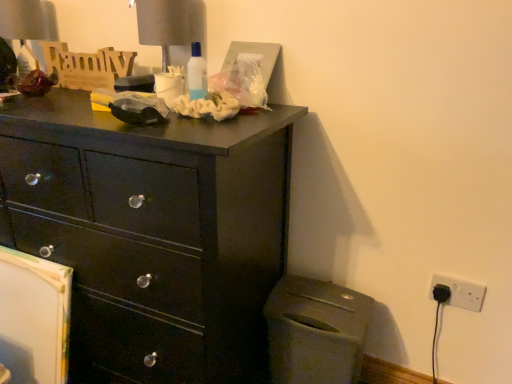
The image size is (512, 384). In order to click on matte gray table lamp at upper center, marked as the first table lamp in a right-to-left arrangement in this screenshot , I will do `click(170, 24)`.

This screenshot has width=512, height=384. Describe the element at coordinates (316, 331) in the screenshot. I see `matte gray trash can at lower right` at that location.

Image resolution: width=512 pixels, height=384 pixels. I want to click on white plastic electric outlet at lower right, so click(x=460, y=292).

Considering the positions of objects white plastic electric outlet at lower right and matte gray table lamp at upper left, the second table lamp positioned from the right, in the image provided, who is more to the left, white plastic electric outlet at lower right or matte gray table lamp at upper left, the second table lamp positioned from the right,?

Positioned to the left is matte gray table lamp at upper left, the second table lamp positioned from the right.

From the image's perspective, is white plastic electric outlet at lower right positioned above or below matte gray table lamp at upper left, the second table lamp positioned from the right?

From the image's perspective, white plastic electric outlet at lower right appears below matte gray table lamp at upper left, the second table lamp positioned from the right.

Is white plastic electric outlet at lower right not within matte gray table lamp at upper left, the second table lamp positioned from the right?

Indeed, white plastic electric outlet at lower right is completely outside matte gray table lamp at upper left, the second table lamp positioned from the right.

Is matte black dresser at upper left completely or partially outside of white plastic electric outlet at lower right?

Yes, matte black dresser at upper left is outside of white plastic electric outlet at lower right.

Where is `electric outlet below the matte black dresser at upper left (from a real-world perspective)`? electric outlet below the matte black dresser at upper left (from a real-world perspective) is located at coordinates (460, 292).

In the scene shown: From a real-world perspective, is matte black dresser at upper left located higher than white plastic electric outlet at lower right?

Yes, from a real-world perspective, matte black dresser at upper left is above white plastic electric outlet at lower right.

How different are the orientations of matte black dresser at upper left and white plastic electric outlet at lower right in degrees?

There is a 0.537-degree angle between the facing directions of matte black dresser at upper left and white plastic electric outlet at lower right.

Is matte gray table lamp at upper left, which appears as the 1th table lamp when viewed from the back, not close to matte black dresser at upper left?

They are positioned close to each other.

Is matte gray table lamp at upper left, which appears as the 1th table lamp when viewed from the back, facing away from matte black dresser at upper left?

No, matte black dresser at upper left is not at the back of matte gray table lamp at upper left, which appears as the 1th table lamp when viewed from the back.

Is matte gray table lamp at upper left, placed as the 1th table lamp when sorted from left to right, situated inside matte black dresser at upper left or outside?

matte gray table lamp at upper left, placed as the 1th table lamp when sorted from left to right, is outside matte black dresser at upper left.

From a real-world perspective, is matte gray table lamp at upper left, which appears as the 1th table lamp when viewed from the back, positioned above or below matte black dresser at upper left?

In terms of real-world spatial position, matte gray table lamp at upper left, which appears as the 1th table lamp when viewed from the back, is above matte black dresser at upper left.

Does matte gray trash can at lower right turn towards matte gray table lamp at upper center, the 2th table lamp when ordered from back to front?

No.

From the image's perspective, which is below, matte gray trash can at lower right or matte gray table lamp at upper center, which is the second table lamp in left-to-right order?

matte gray trash can at lower right is shown below in the image.

From the matte gray trash can at lower right, count 1st table lamps backward and point to it. Please provide its 2D coordinates.

[(170, 24)]

Considering the relative sizes of matte gray trash can at lower right and matte gray table lamp at upper center, which is the second table lamp in left-to-right order, in the image provided, is matte gray trash can at lower right taller than matte gray table lamp at upper center, which is the second table lamp in left-to-right order,?

Yes, matte gray trash can at lower right is taller than matte gray table lamp at upper center, which is the second table lamp in left-to-right order.

Which object is closer to the camera, matte gray table lamp at upper center, which is the second table lamp in left-to-right order, or matte gray trash can at lower right?

matte gray trash can at lower right is closer to the camera.

Is matte gray table lamp at upper center, which ranks as the first table lamp in front-to-back order, bigger than matte gray trash can at lower right?

Incorrect, matte gray table lamp at upper center, which ranks as the first table lamp in front-to-back order, is not larger than matte gray trash can at lower right.

Considering the relative sizes of matte gray table lamp at upper center, which ranks as the first table lamp in front-to-back order, and matte gray trash can at lower right in the image provided, is matte gray table lamp at upper center, which ranks as the first table lamp in front-to-back order, thinner than matte gray trash can at lower right?

Indeed, matte gray table lamp at upper center, which ranks as the first table lamp in front-to-back order, has a lesser width compared to matte gray trash can at lower right.

From the image's perspective, which one is positioned lower, matte gray table lamp at upper center, which ranks as the first table lamp in front-to-back order, or matte gray trash can at lower right?

matte gray trash can at lower right is shown below in the image.

From a real-world perspective, relative to matte black dresser at upper left, is matte gray trash can at lower right vertically above or below?

From a real-world perspective, matte gray trash can at lower right is physically below matte black dresser at upper left.

Where is `cabinetry to the right of matte black dresser at upper left`? The width and height of the screenshot is (512, 384). cabinetry to the right of matte black dresser at upper left is located at coordinates (316, 331).

Does matte gray trash can at lower right have a greater width compared to matte black dresser at upper left?

In fact, matte gray trash can at lower right might be narrower than matte black dresser at upper left.

Considering the relative positions of matte gray trash can at lower right and matte black dresser at upper left in the image provided, is matte gray trash can at lower right to the left or to the right of matte black dresser at upper left?

Clearly, matte gray trash can at lower right is on the right of matte black dresser at upper left in the image.

Can you confirm if white plastic electric outlet at lower right is smaller than matte gray table lamp at upper center, the 2th table lamp when ordered from back to front?

Indeed, white plastic electric outlet at lower right has a smaller size compared to matte gray table lamp at upper center, the 2th table lamp when ordered from back to front.

The image size is (512, 384). Identify the location of electric outlet behind the matte gray table lamp at upper center, which ranks as the first table lamp in front-to-back order. coord(460,292).

Is white plastic electric outlet at lower right facing towards matte gray table lamp at upper center, marked as the first table lamp in a right-to-left arrangement?

No, white plastic electric outlet at lower right does not turn towards matte gray table lamp at upper center, marked as the first table lamp in a right-to-left arrangement.

From a real-world perspective, is white plastic electric outlet at lower right located beneath matte gray table lamp at upper center, which ranks as the first table lamp in front-to-back order?

Yes, from a real-world perspective, white plastic electric outlet at lower right is beneath matte gray table lamp at upper center, which ranks as the first table lamp in front-to-back order.

You are a GUI agent. You are given a task and a screenshot of the screen. Output one action in this format:
    pyautogui.click(x=<x>, y=<y>)
    Task: Click on the electric outlet below the matte gray table lamp at upper left, the second table lamp positioned from the right (from a real-world perspective)
    
    Given the screenshot: What is the action you would take?
    pyautogui.click(x=460, y=292)

Locate an element on the screen. The image size is (512, 384). the chest of drawers that appears above the white plastic electric outlet at lower right (from a real-world perspective) is located at coordinates coord(153,233).

In the scene shown: Considering their positions, is matte black dresser at upper left positioned further to matte gray table lamp at upper left, placed as the 1th table lamp when sorted from left to right, than white plastic electric outlet at lower right?

The object further to matte gray table lamp at upper left, placed as the 1th table lamp when sorted from left to right, is white plastic electric outlet at lower right.

When comparing their distances from matte gray table lamp at upper left, placed as the 1th table lamp when sorted from left to right, does white plastic electric outlet at lower right or matte gray table lamp at upper center, which ranks as the first table lamp in front-to-back order, seem further?

white plastic electric outlet at lower right.

Which object lies further to the anchor point matte gray table lamp at upper left, the second table lamp positioned from the right, white plastic electric outlet at lower right or matte black dresser at upper left?

white plastic electric outlet at lower right is positioned further to the anchor matte gray table lamp at upper left, the second table lamp positioned from the right.

Considering their positions, is matte gray table lamp at upper center, marked as the first table lamp in a right-to-left arrangement, positioned further to matte gray table lamp at upper left, the second table lamp positioned from the right, than white plastic electric outlet at lower right?

white plastic electric outlet at lower right lies further to matte gray table lamp at upper left, the second table lamp positioned from the right, than the other object.

Which object lies nearer to the anchor point matte gray table lamp at upper left, which appears as the 1th table lamp when viewed from the back, matte gray table lamp at upper center, the 2th table lamp when ordered from back to front, or matte gray trash can at lower right?

matte gray table lamp at upper center, the 2th table lamp when ordered from back to front, is positioned closer to the anchor matte gray table lamp at upper left, which appears as the 1th table lamp when viewed from the back.

When comparing their distances from matte gray table lamp at upper left, which appears as the 1th table lamp when viewed from the back, does matte gray trash can at lower right or white plastic electric outlet at lower right seem further?

white plastic electric outlet at lower right.

When comparing their distances from white plastic electric outlet at lower right, does matte gray table lamp at upper center, which ranks as the first table lamp in front-to-back order, or matte black dresser at upper left seem further?

The object further to white plastic electric outlet at lower right is matte gray table lamp at upper center, which ranks as the first table lamp in front-to-back order.

Looking at the image, which one is located further to matte gray table lamp at upper left, marked as the 2th table lamp in a front-to-back arrangement, matte gray trash can at lower right or matte black dresser at upper left?

matte gray trash can at lower right is further to matte gray table lamp at upper left, marked as the 2th table lamp in a front-to-back arrangement.

What are the coordinates of `cabinetry between matte gray table lamp at upper left, marked as the 2th table lamp in a front-to-back arrangement, and white plastic electric outlet at lower right` in the screenshot? It's located at (316, 331).

Identify the location of electric outlet between matte gray table lamp at upper center, the 2th table lamp when ordered from back to front, and matte gray trash can at lower right in the up-down direction. This screenshot has height=384, width=512. (460, 292).

Find the location of `table lamp between matte gray table lamp at upper left, the second table lamp positioned from the right, and white plastic electric outlet at lower right from left to right`. table lamp between matte gray table lamp at upper left, the second table lamp positioned from the right, and white plastic electric outlet at lower right from left to right is located at coordinates (170, 24).

At what (x,y) coordinates should I click in order to perform the action: click on table lamp located between matte black dresser at upper left and white plastic electric outlet at lower right in the left-right direction. Please return your answer as a coordinate pair (x, y). The width and height of the screenshot is (512, 384). Looking at the image, I should click on (170, 24).